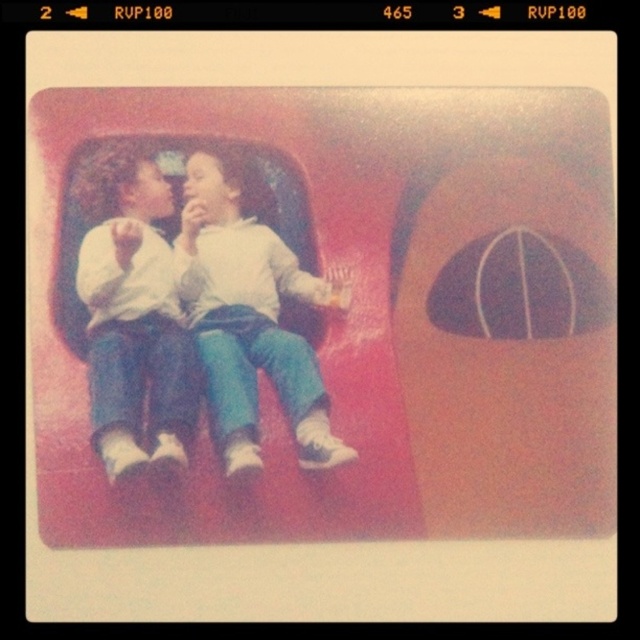
Based on the scene described, which clothing item is positioned higher on the children? The matte white hoodie at center or the white cotton shirt at center?

The matte white hoodie at center is located above the white cotton shirt at center, so the hoodie is positioned higher.

In the vintage photograph, there are two children sitting on a red rounded structure. The child wearing a matte white hoodie at center is interacting with the child in a white cotton shirt at center. From the observer viewing the photo, which child appears closer to the front?

The matte white hoodie at center appears closer to the front because the white cotton shirt at center is behind it.